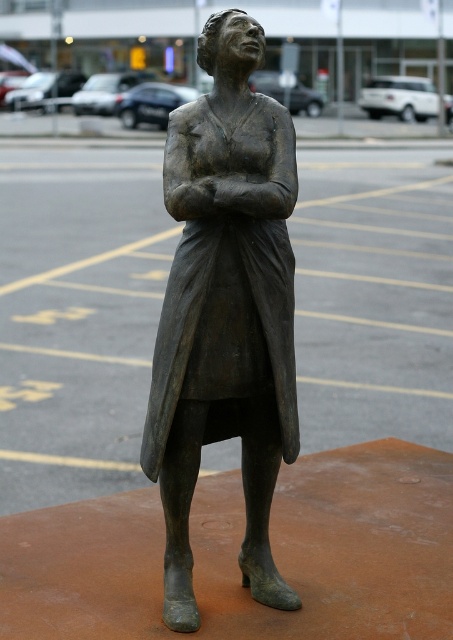
Question: Can you confirm if bronze statue at center is positioned to the left of metallic parking lot at upper center?

Choices:
 (A) no
 (B) yes

Answer: (A)

Question: Is bronze statue at center thinner than metallic parking lot at upper center?

Choices:
 (A) no
 (B) yes

Answer: (B)

Question: Can you confirm if bronze statue at center is positioned to the right of metallic parking lot at upper center?

Choices:
 (A) yes
 (B) no

Answer: (A)